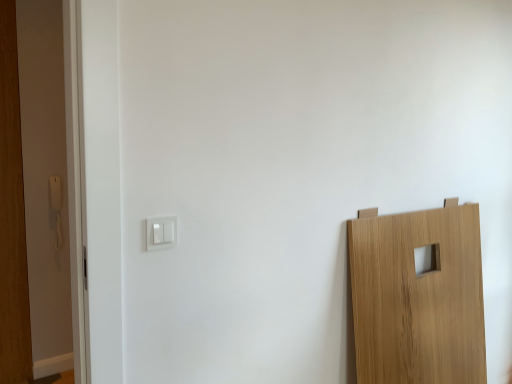
Question: From a real-world perspective, is white plastic light switch at center-left, marked as the first light switch in a top-to-bottom arrangement, over white plastic light switch at upper left, which ranks as the 2th light switch in back-to-front order?

Choices:
 (A) no
 (B) yes

Answer: (A)

Question: Considering the relative positions of white plastic light switch at center-left, the 2th light switch when ordered from front to back, and white plastic light switch at upper left, which ranks as the 2th light switch in back-to-front order, in the image provided, is white plastic light switch at center-left, the 2th light switch when ordered from front to back, behind white plastic light switch at upper left, which ranks as the 2th light switch in back-to-front order,?

Choices:
 (A) no
 (B) yes

Answer: (B)

Question: Would you say white plastic light switch at center-left, the 2th light switch when ordered from front to back, is outside white plastic light switch at upper left, the 1th light switch when ordered from bottom to top?

Choices:
 (A) yes
 (B) no

Answer: (A)

Question: From the image's perspective, is white plastic light switch at center-left, the 2th light switch when ordered from front to back, below white plastic light switch at upper left, the 1th light switch when ordered from bottom to top?

Choices:
 (A) yes
 (B) no

Answer: (B)

Question: From the image's perspective, is white plastic light switch at center-left, which is the first light switch from back to front, over white plastic light switch at upper left, positioned as the first light switch in front-to-back order?

Choices:
 (A) yes
 (B) no

Answer: (A)

Question: Does white plastic light switch at center-left, which is the first light switch in left-to-right order, have a smaller size compared to white plastic light switch at upper left, the 1th light switch from the right?

Choices:
 (A) yes
 (B) no

Answer: (B)

Question: Is white plastic light switch at upper left, the 1th light switch when ordered from bottom to top, bigger than white plastic light switch at center-left, marked as the first light switch in a top-to-bottom arrangement?

Choices:
 (A) no
 (B) yes

Answer: (A)

Question: Is white plastic light switch at upper left, the 1th light switch when ordered from bottom to top, to the left of white plastic light switch at center-left, the 2th light switch when ordered from front to back, from the viewer's perspective?

Choices:
 (A) yes
 (B) no

Answer: (B)

Question: Can you confirm if white plastic light switch at upper left, the 1th light switch when ordered from bottom to top, is thinner than white plastic light switch at center-left, acting as the 2th light switch starting from the right?

Choices:
 (A) yes
 (B) no

Answer: (A)

Question: Is white plastic light switch at upper left, which ranks as the 2th light switch in back-to-front order, facing towards white plastic light switch at center-left, marked as the first light switch in a top-to-bottom arrangement?

Choices:
 (A) no
 (B) yes

Answer: (A)

Question: Is white plastic light switch at upper left, which ranks as the 2th light switch in left-to-right order, next to white plastic light switch at center-left, marked as the first light switch in a top-to-bottom arrangement, and touching it?

Choices:
 (A) yes
 (B) no

Answer: (B)

Question: Is white plastic light switch at upper left, which ranks as the 2th light switch in back-to-front order, shorter than white plastic light switch at center-left, which is the first light switch in left-to-right order?

Choices:
 (A) no
 (B) yes

Answer: (B)

Question: Is point tap(155, 225) positioned closer to the camera than point tap(55, 210)?

Choices:
 (A) farther
 (B) closer

Answer: (B)